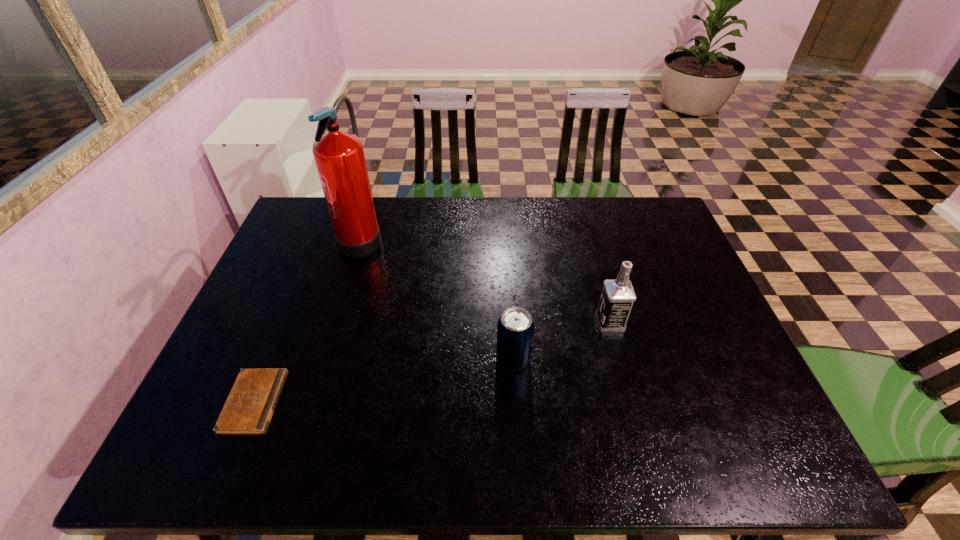
What are the coordinates of `free space between the second tallest object and the leftmost object` in the screenshot? It's located at (432, 362).

Identify the location of free space between the second object from right to left and the shortest object. The width and height of the screenshot is (960, 540). (384, 381).

You are a GUI agent. You are given a task and a screenshot of the screen. Output one action in this format:
    pyautogui.click(x=<x>, y=<y>)
    Task: Click on the object that can be found as the second closest to the leftmost object
    This screenshot has height=540, width=960.
    Given the screenshot: What is the action you would take?
    pyautogui.click(x=515, y=329)

Identify the location of object that can be found as the third closest to the fire extinguisher. (618, 295).